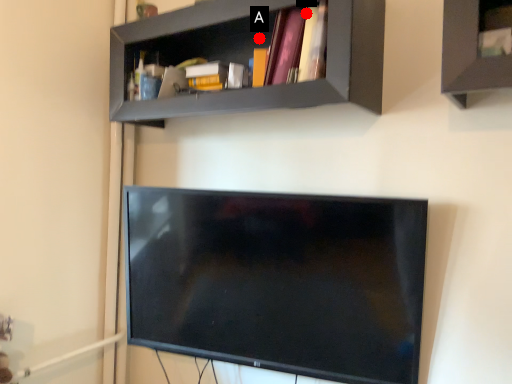
Question: Two points are circled on the image, labeled by A and B beside each circle. Which point appears farthest from the camera in this image?

Choices:
 (A) A is further
 (B) B is further

Answer: (A)